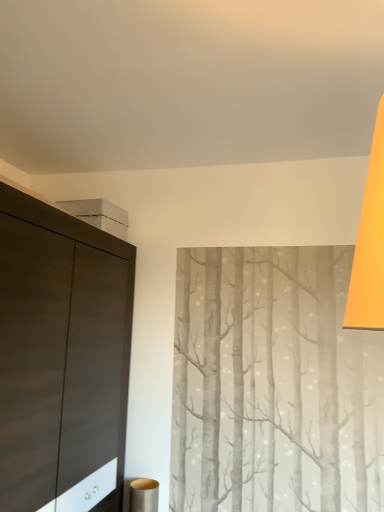
The image size is (384, 512). I want to click on matte black cupboard at left, so click(61, 357).

Describe the element at coordinates (61, 357) in the screenshot. The image size is (384, 512). I see `matte black cupboard at left` at that location.

Locate an element on the screen. The height and width of the screenshot is (512, 384). matte black cupboard at left is located at coordinates (61, 357).